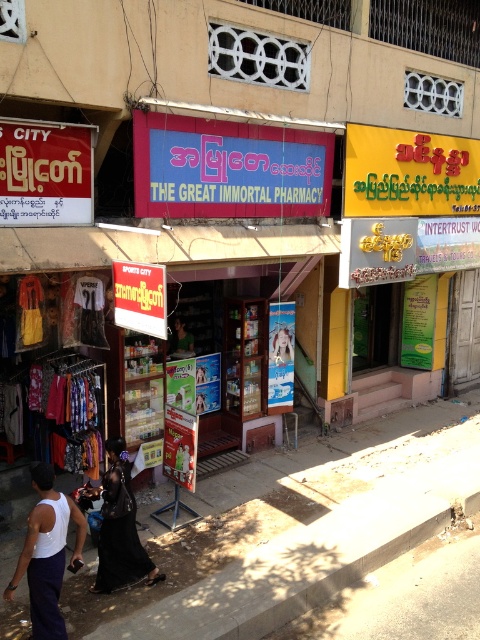
Which of these two, white fabric tank top at lower left or black leather dress at lower center, stands shorter?

With less height is black leather dress at lower center.

At what (x,y) coordinates should I click in order to perform the action: click on white fabric tank top at lower left. Please return your answer as a coordinate pair (x, y). Looking at the image, I should click on (47, 554).

Between point (61, 554) and point (108, 516), which one is positioned in front?

Point (61, 554) is in front.

Image resolution: width=480 pixels, height=640 pixels. What are the coordinates of `white fabric tank top at lower left` in the screenshot? It's located at (47, 554).

The width and height of the screenshot is (480, 640). Describe the element at coordinates (228, 168) in the screenshot. I see `blue matte sign at center` at that location.

This screenshot has width=480, height=640. Find the location of `blue matte sign at center`. blue matte sign at center is located at coordinates (228, 168).

Does black leather dress at lower center have a greater width compared to matte black shirt at center?

Correct, the width of black leather dress at lower center exceeds that of matte black shirt at center.

This screenshot has height=640, width=480. Describe the element at coordinates (120, 529) in the screenshot. I see `black leather dress at lower center` at that location.

Identify the location of black leather dress at lower center. Image resolution: width=480 pixels, height=640 pixels. (120, 529).